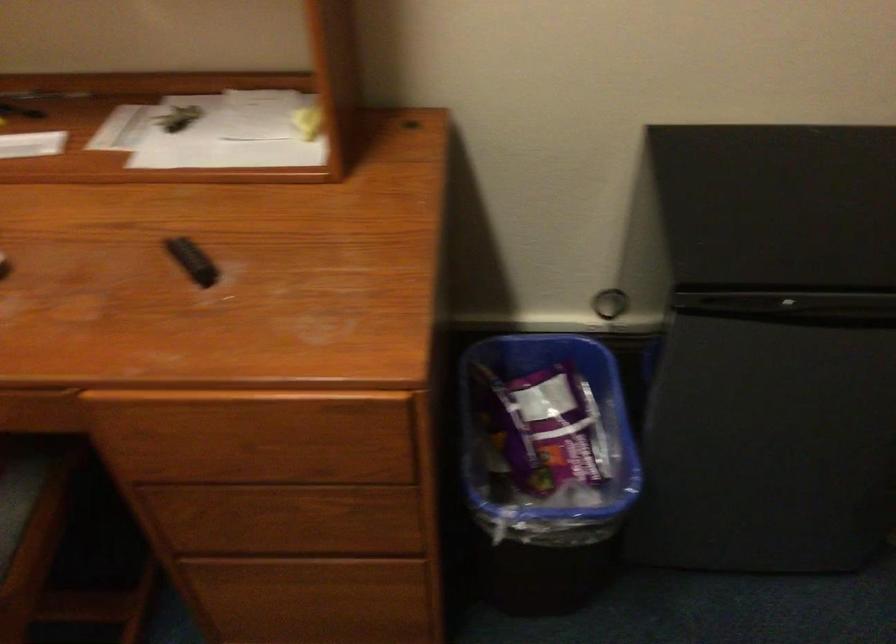
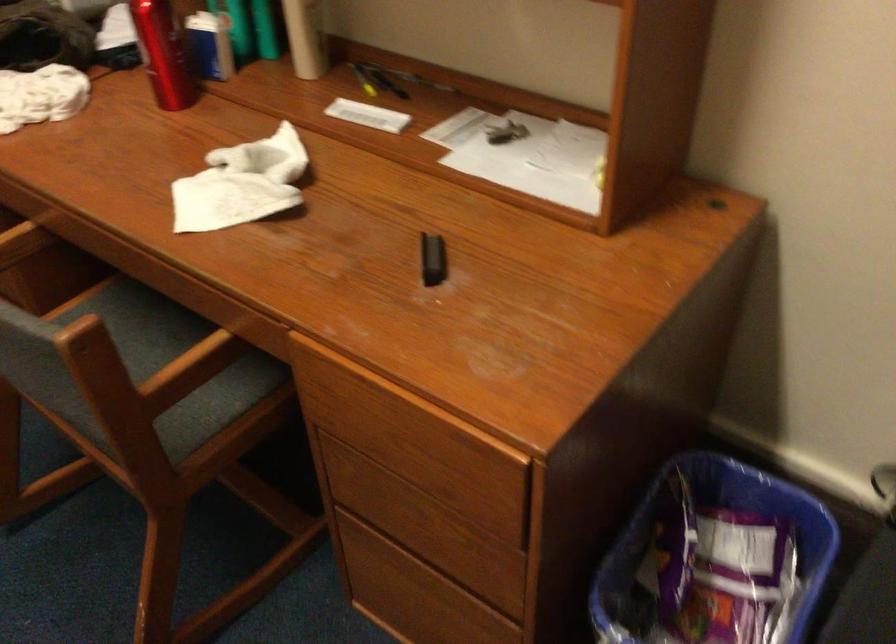
Where in the second image is the point corresponding to point (178, 118) from the first image?

(504, 131)